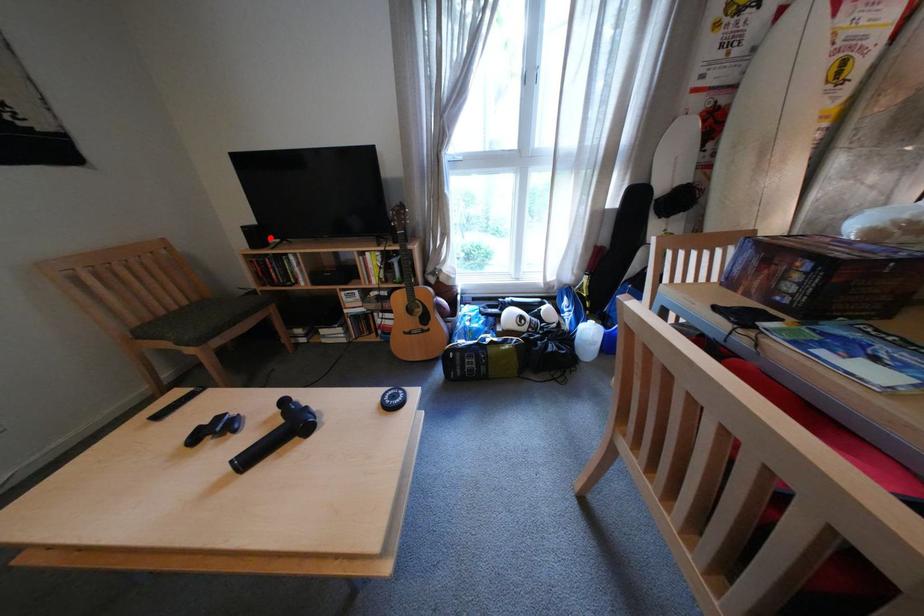
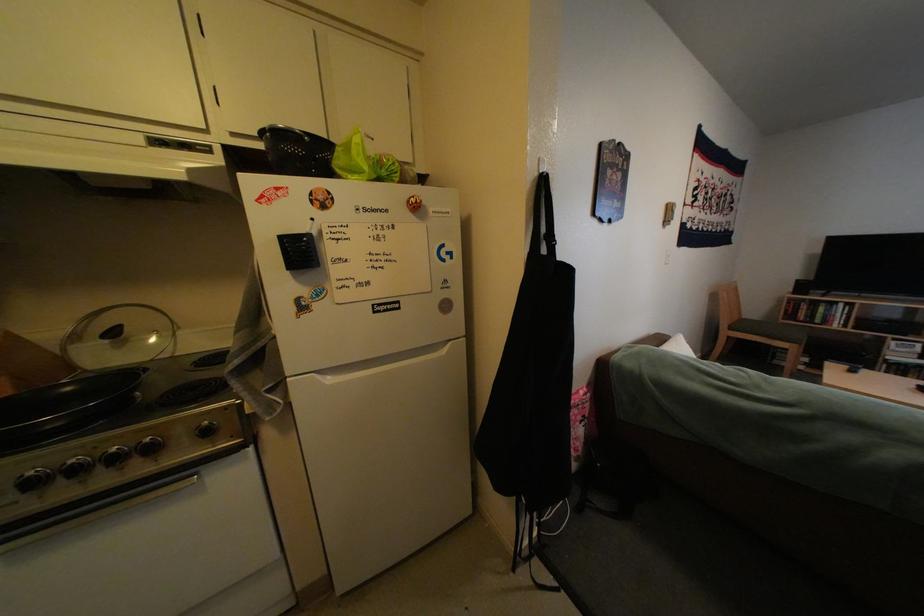
Find the pixel in the second image that matches the highlighted location in the first image.

(816, 288)